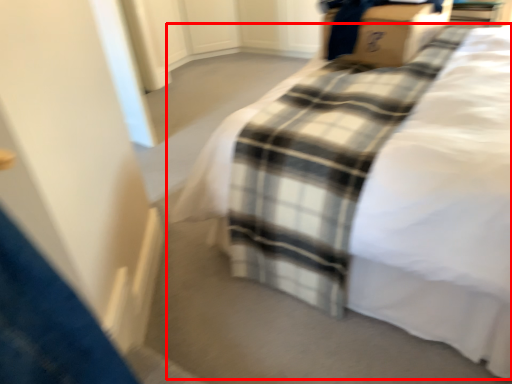
Question: From the image's perspective, considering the relative positions of bed (annotated by the red box) and cardboard box in the image provided, where is bed (annotated by the red box) located with respect to the staircase?

Choices:
 (A) above
 (B) below

Answer: (B)